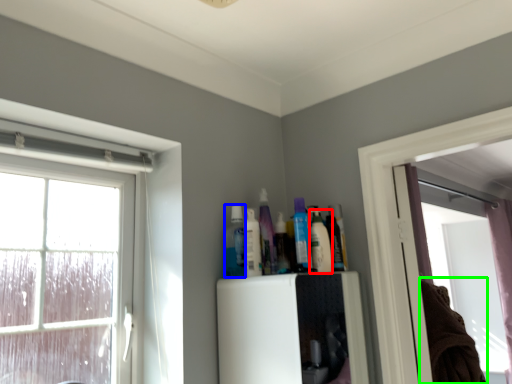
Question: Considering the real-world distances, which object is closest to toiletry (highlighted by a red box)? toiletry (highlighted by a blue box) or laundry (highlighted by a green box).

Choices:
 (A) toiletry
 (B) laundry

Answer: (A)